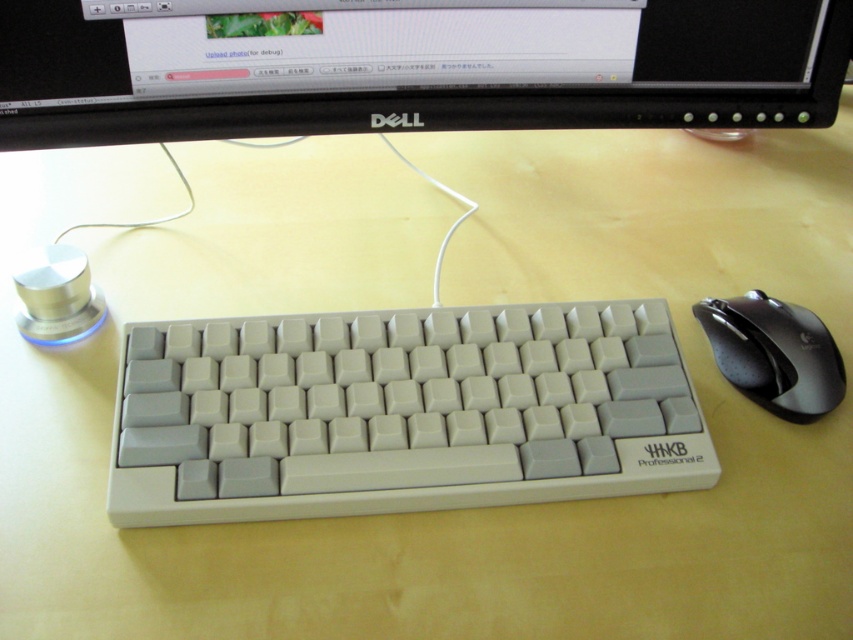
Question: Can you confirm if white plastic keyboard at center is positioned to the right of black plastic mouse at right?

Choices:
 (A) yes
 (B) no

Answer: (B)

Question: Does black plastic monitor at upper center come in front of black plastic mouse at right?

Choices:
 (A) no
 (B) yes

Answer: (B)

Question: Is black plastic monitor at upper center to the left of black plastic mouse at right from the viewer's perspective?

Choices:
 (A) yes
 (B) no

Answer: (A)

Question: Among these objects, which one is nearest to the camera?

Choices:
 (A) white plastic keyboard at center
 (B) black plastic monitor at upper center

Answer: (A)

Question: Which point is closer to the camera?

Choices:
 (A) black plastic mouse at right
 (B) black plastic monitor at upper center
 (C) white plastic keyboard at center

Answer: (C)

Question: Which object is positioned closest to the black plastic mouse at right?

Choices:
 (A) white plastic keyboard at center
 (B) black plastic monitor at upper center

Answer: (A)